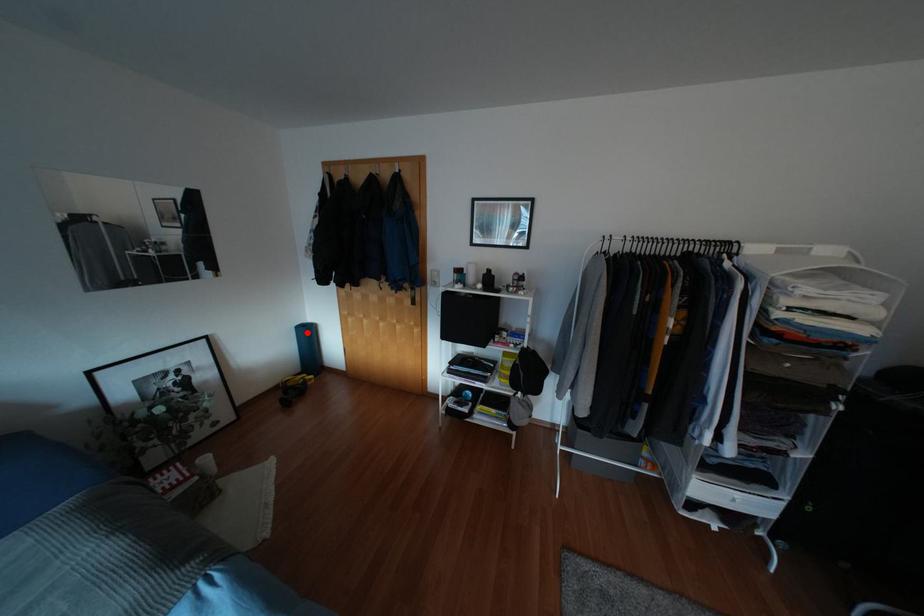
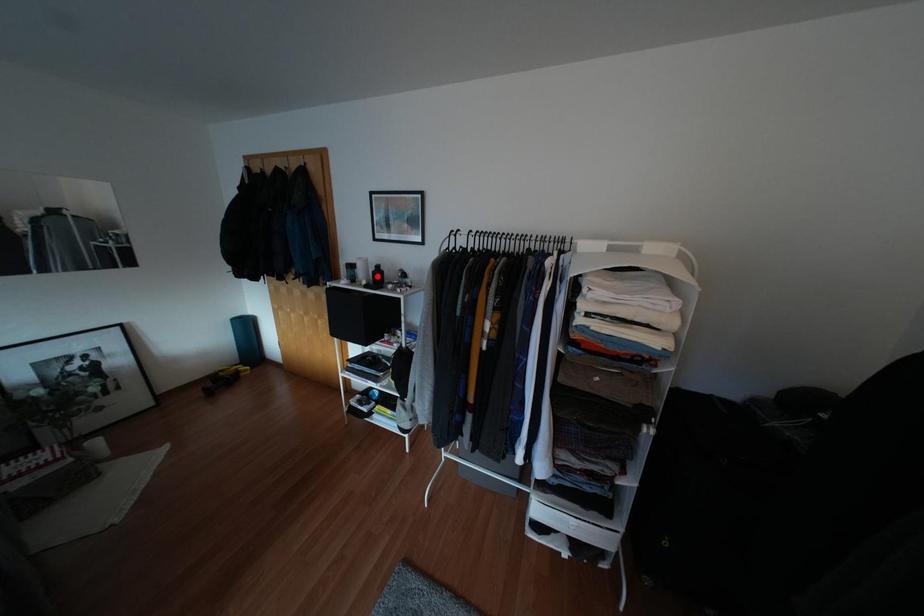
I am providing you with two images of the same scene from different viewpoints. A red point is marked on the first image and another point is marked on the second image. Are the points marked in image1 and image2 representing the same 3D position?

No